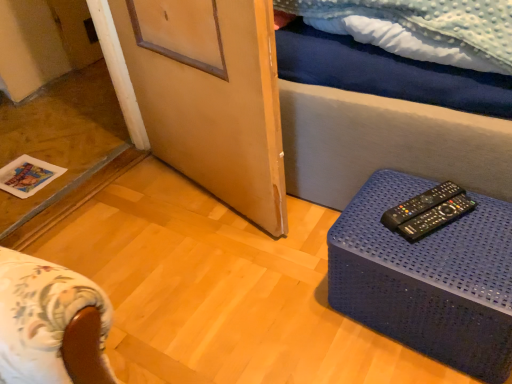
Identify the location of free point to the right of black plastic remote control at right, positioned as the 1th remote control in back-to-front order. (483, 207).